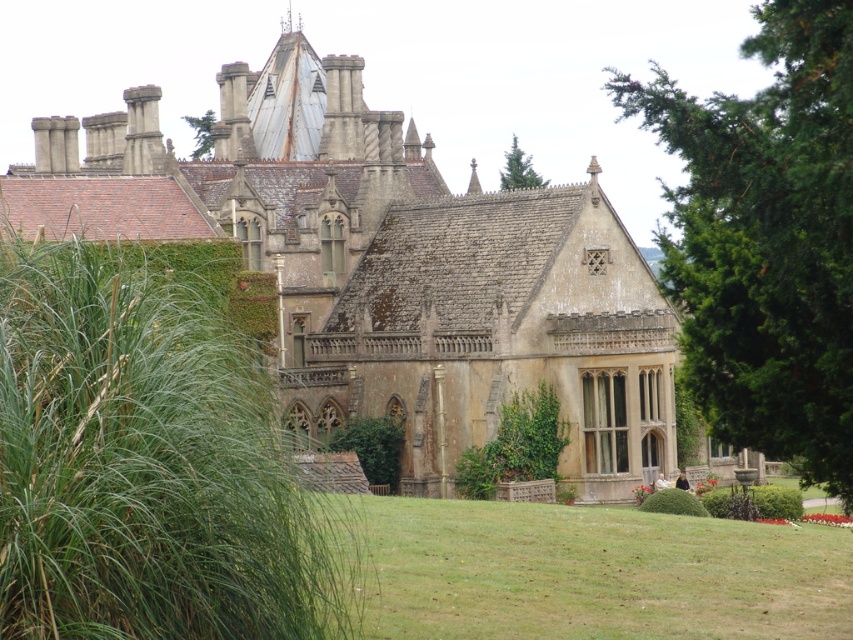
Question: Among these points, which one is nearest to the camera?

Choices:
 (A) (836, 88)
 (B) (204, 177)

Answer: (A)

Question: Which object is closer to the camera taking this photo?

Choices:
 (A) green coniferous tree at upper center
 (B) green leafy tree at upper center
 (C) green grass at lower center

Answer: (C)

Question: Can you confirm if stone mansion at center is bigger than green leafy tree at upper right?

Choices:
 (A) yes
 (B) no

Answer: (A)

Question: From the image, what is the correct spatial relationship of stone mansion at center in relation to green leafy tree at upper right?

Choices:
 (A) below
 (B) above

Answer: (A)

Question: Is stone mansion at center below green coniferous tree at upper center?

Choices:
 (A) no
 (B) yes

Answer: (B)

Question: Which object is farther from the camera taking this photo?

Choices:
 (A) green grass at lower center
 (B) stone mansion at center
 (C) green leafy tree at upper right

Answer: (B)